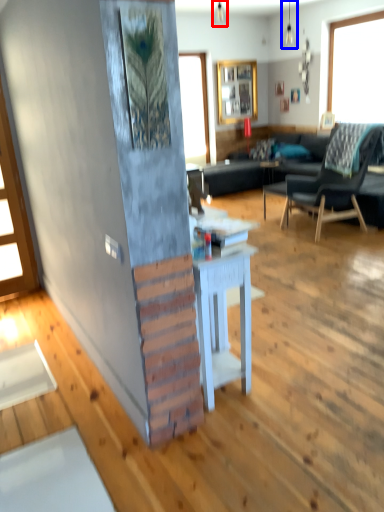
Question: Among these objects, which one is farthest to the camera, lamp (highlighted by a red box) or lamp (highlighted by a blue box)?

Choices:
 (A) lamp
 (B) lamp

Answer: (A)